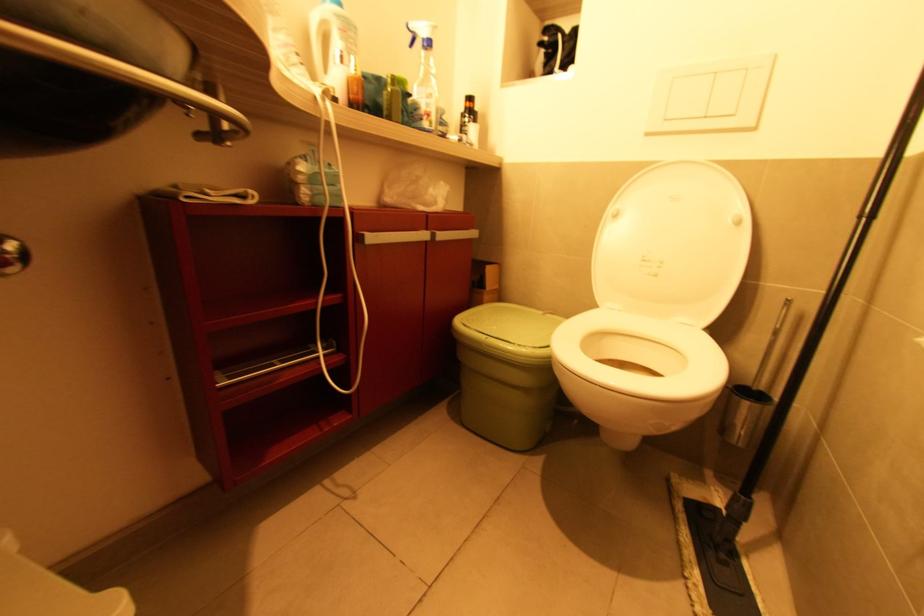
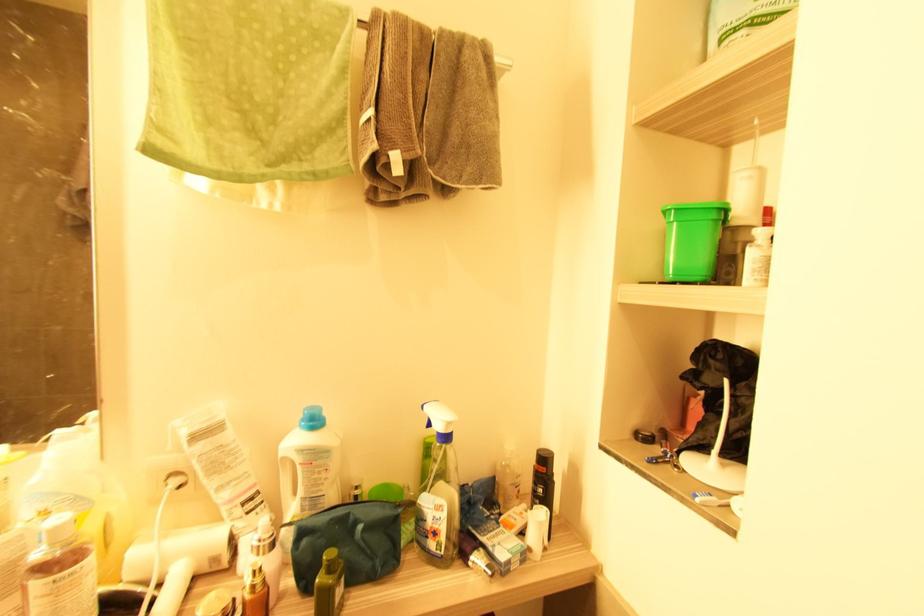
In the second image, find the point that corresponds to [350,34] in the first image.

(315, 464)